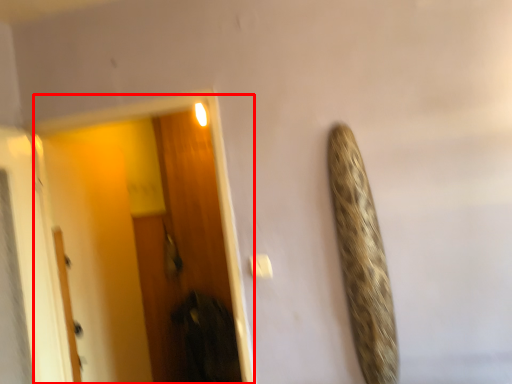
Question: In this image, where is screen door (annotated by the red box) located relative to door?

Choices:
 (A) right
 (B) left

Answer: (A)